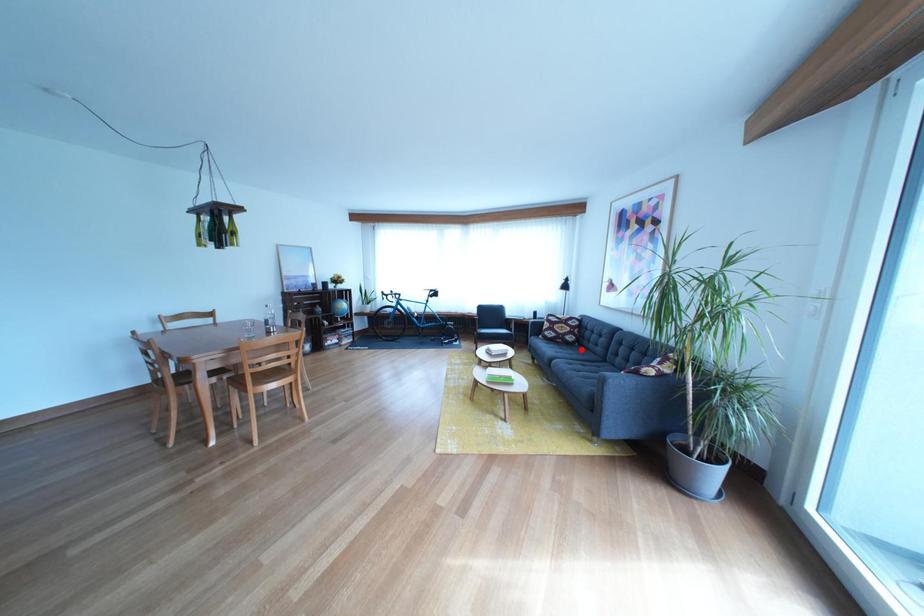
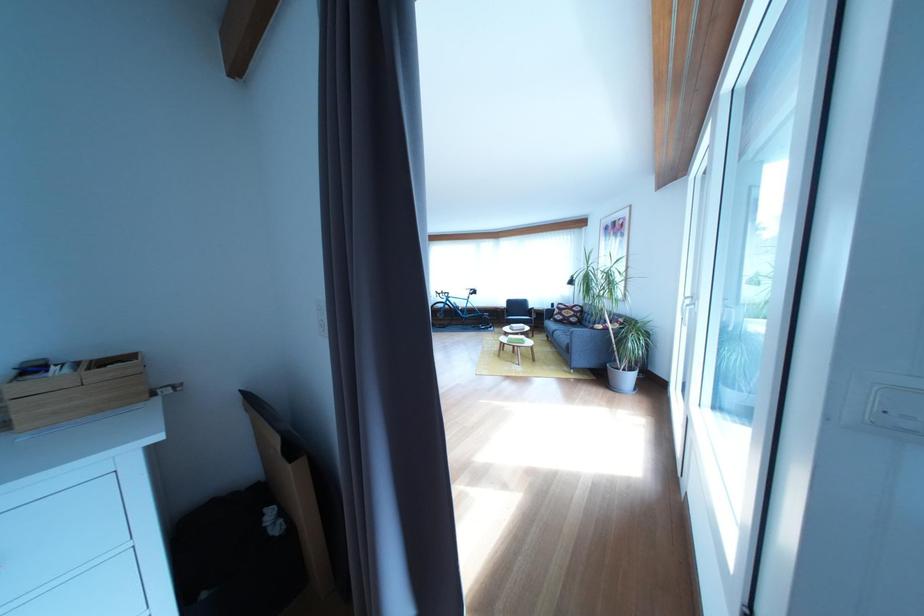
Where in the second image is the point corresponding to the highlighted location from the first image?

(585, 330)